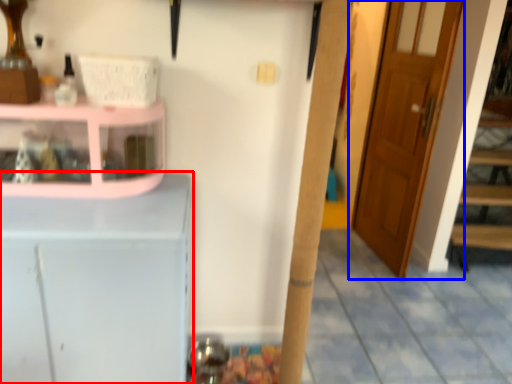
Question: Among these objects, which one is nearest to the camera, cabinetry (highlighted by a red box) or door (highlighted by a blue box)?

Choices:
 (A) cabinetry
 (B) door

Answer: (A)